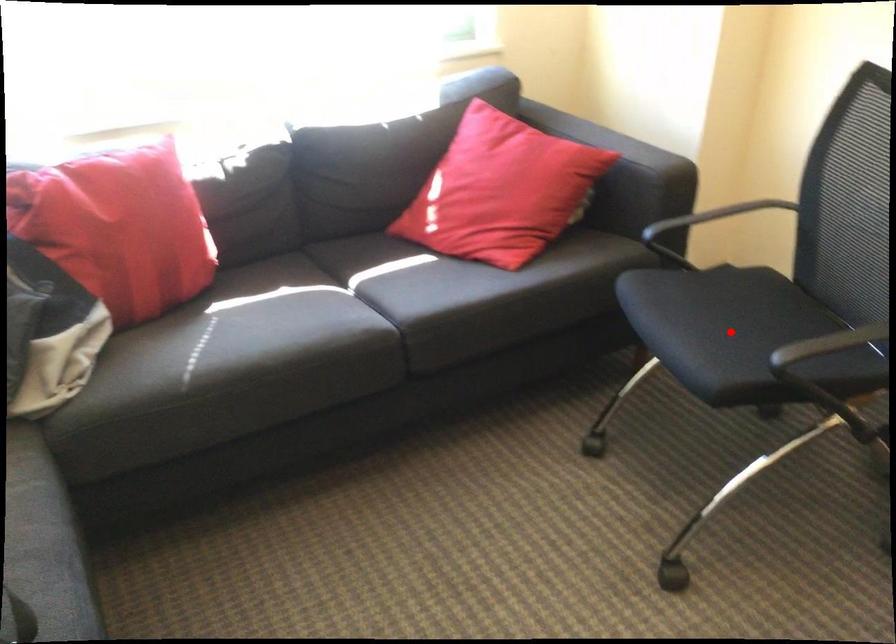
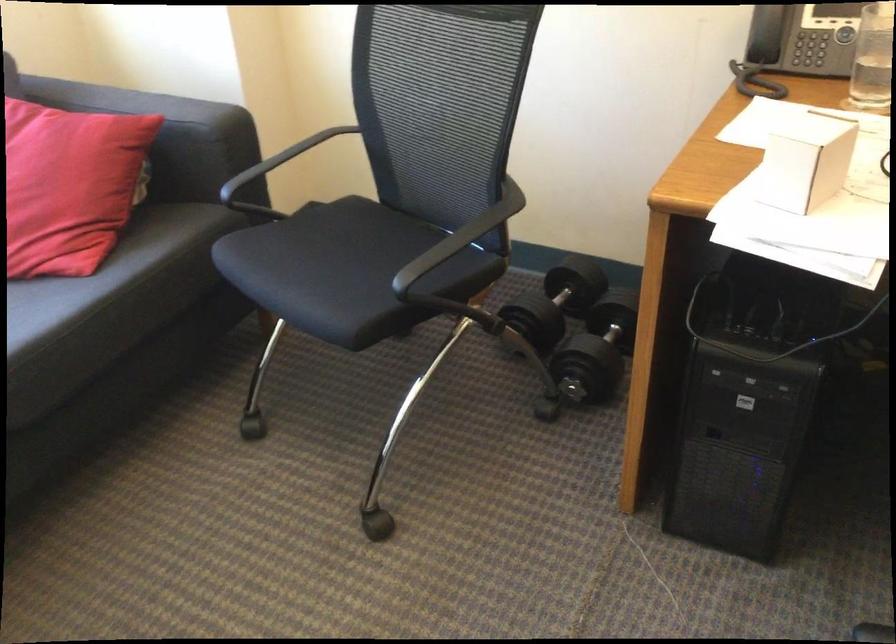
Where in the second image is the point corresponding to the highlighted location from the first image?

(343, 270)